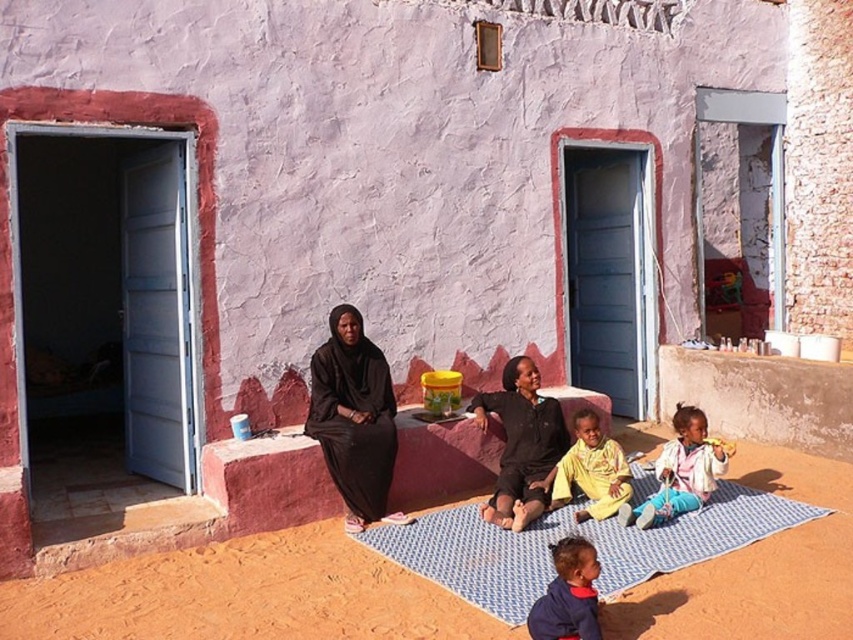
You are a photographer trying to capture a clear photo of both the black matte dress at center and the yellow cotton shirt at center. Since the camera can only focus on one object at a time, which one should you choose to ensure the other is still somewhat in focus?

The black matte dress at center is bigger than the yellow cotton shirt at center. To ensure both are somewhat in focus, you should focus on the black matte dress at center because its larger size will keep the yellow cotton shirt at center within the depth of field.